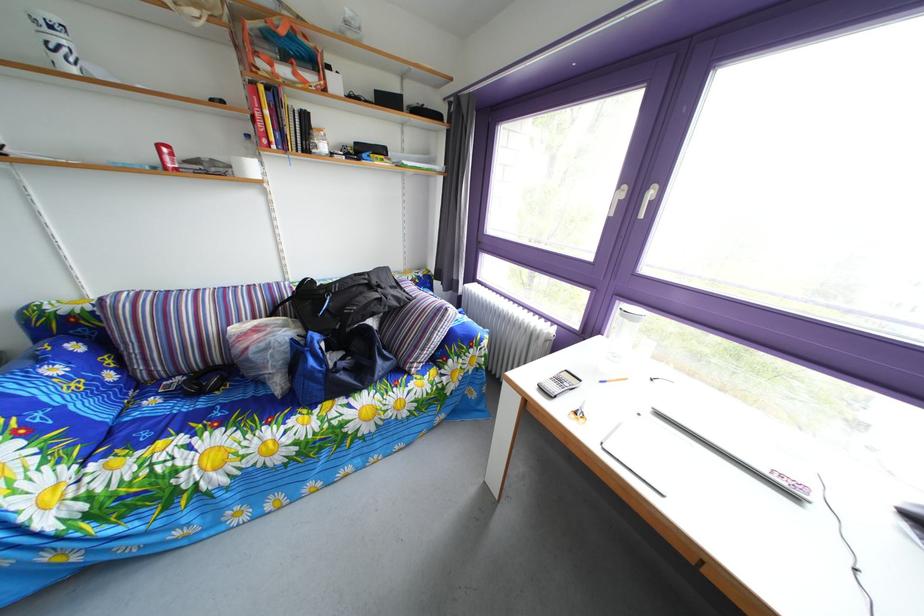
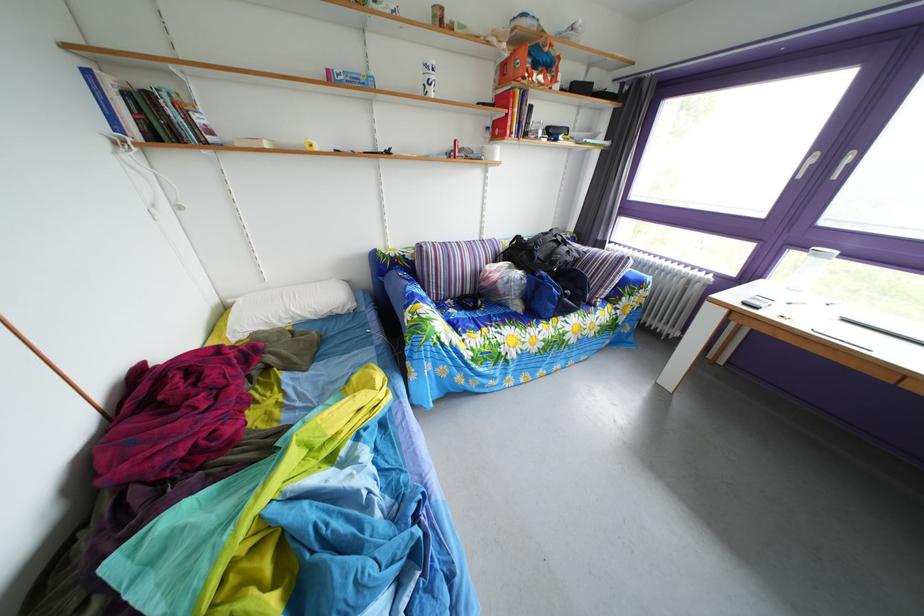
Find the pixel in the second image that matches point 164,410 in the first image.

(463, 320)